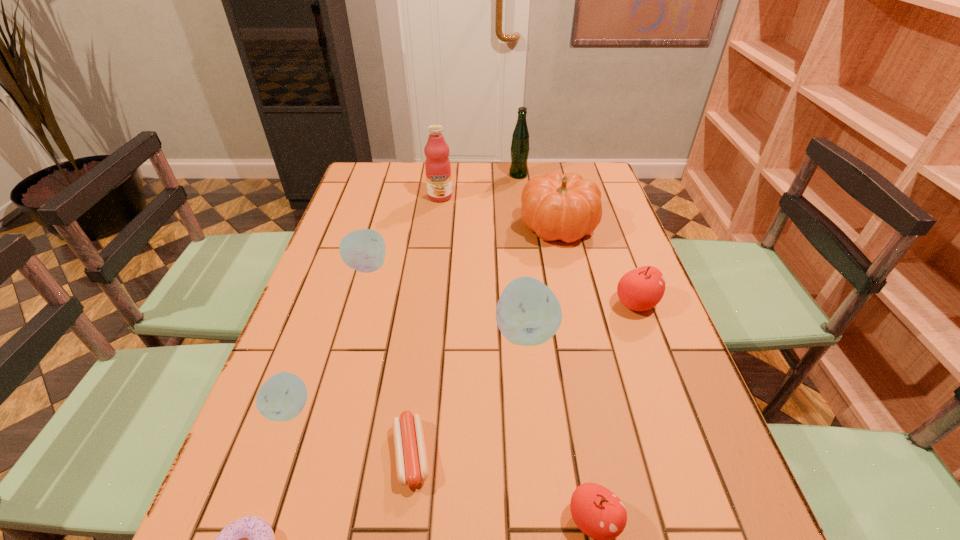
At what (x,y) coordinates should I click in order to perform the action: click on the farthest object. Please return your answer as a coordinate pair (x, y). Looking at the image, I should click on (520, 148).

Locate an element on the screen. beer bottle is located at coordinates (520, 148).

Where is `fruit juice`? The width and height of the screenshot is (960, 540). fruit juice is located at coordinates (437, 165).

In order to click on the ninth nearest object in this screenshot , I will do `click(437, 165)`.

Find the location of a particular element. This screenshot has height=540, width=960. orange pumpkin is located at coordinates (566, 207).

Locate an element on the screen. the eighth nearest object is located at coordinates (566, 207).

I want to click on the biggest white apple, so click(x=528, y=313).

This screenshot has height=540, width=960. Find the location of `the seventh shortest object`. the seventh shortest object is located at coordinates (528, 313).

In order to click on the second biggest white apple in this screenshot , I will do `click(363, 250)`.

I want to click on the farthest apple, so click(363, 250).